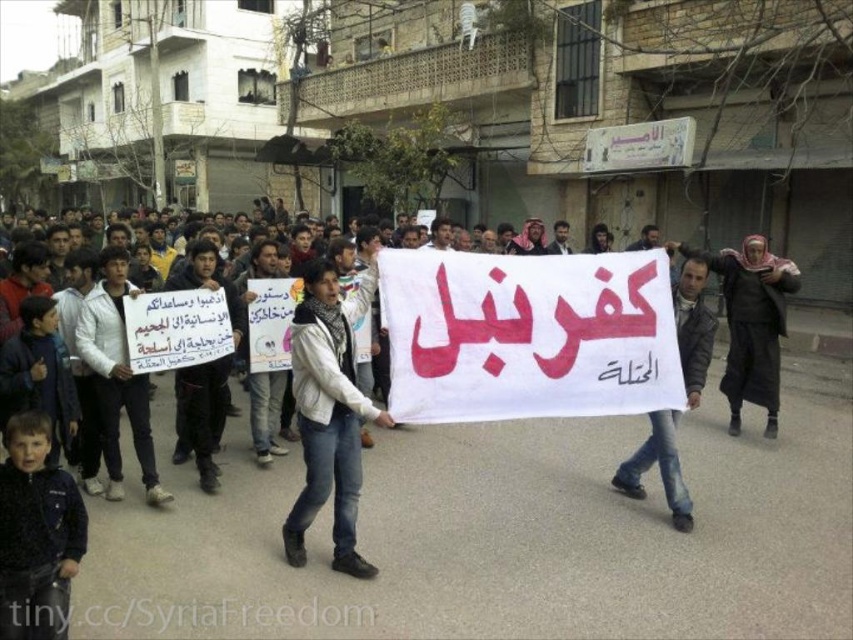
Between white matte jacket at center and dark gray jacket at center, which one has less height?

white matte jacket at center

Does white matte jacket at center have a smaller size compared to dark gray jacket at center?

Indeed, white matte jacket at center has a smaller size compared to dark gray jacket at center.

Find the location of `white matte jacket at center`. white matte jacket at center is located at coordinates tap(329, 413).